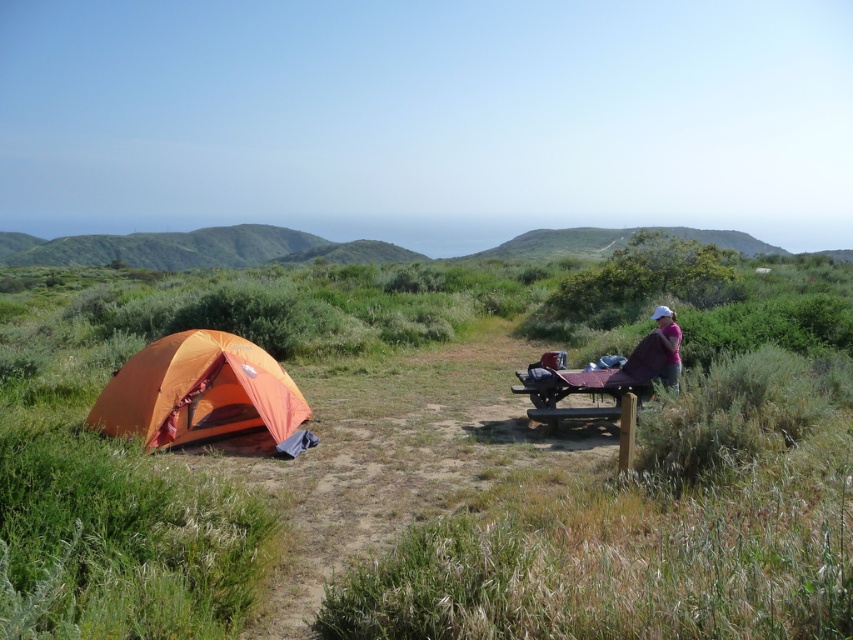
Between orange fabric tent at left and pink fabric at right, which one is positioned higher?

pink fabric at right is higher up.

Between point (201, 360) and point (660, 324), which one is positioned behind?

The point (660, 324) is behind.

This screenshot has width=853, height=640. What are the coordinates of `orange fabric tent at left` in the screenshot? It's located at (198, 392).